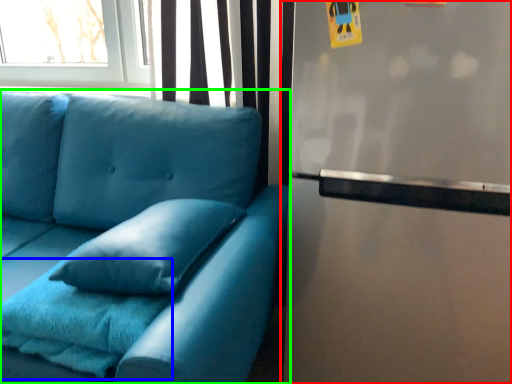
Question: Which is farther away from fridge (highlighted by a red box)? blanket (highlighted by a blue box) or studio couch (highlighted by a green box)?

Choices:
 (A) blanket
 (B) studio couch

Answer: (A)